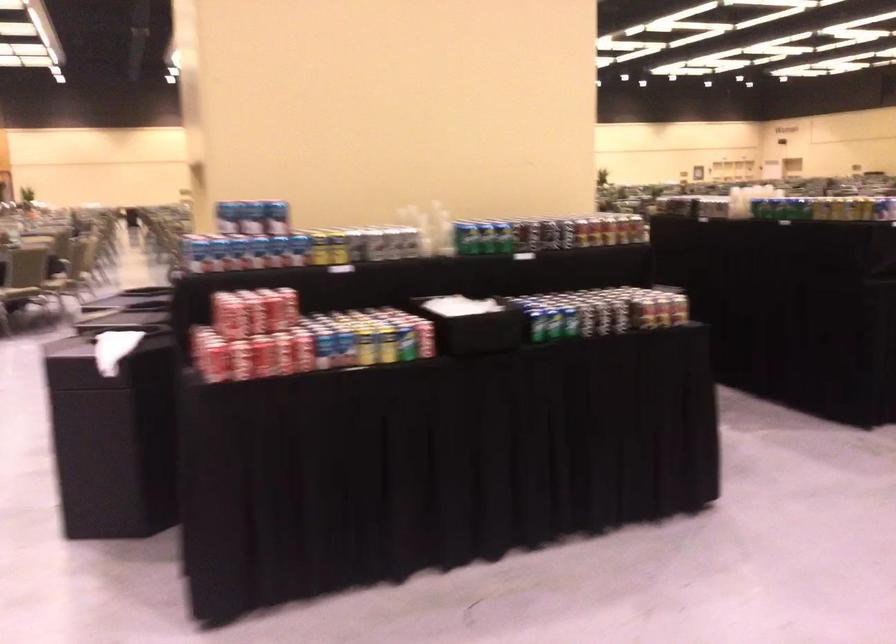
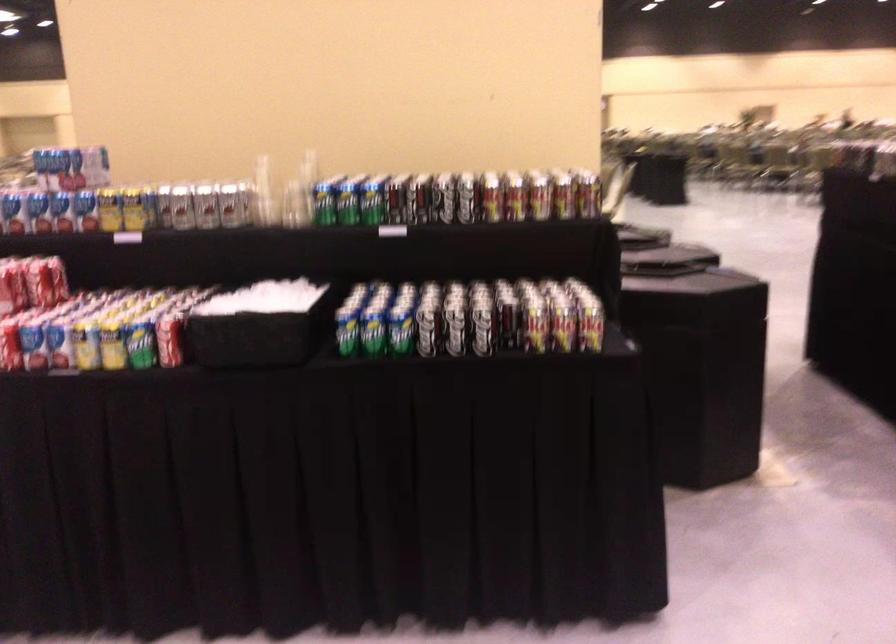
The images are taken continuously from a first-person perspective. In which direction are you moving?

The movement direction of the cameraman is right, forward.